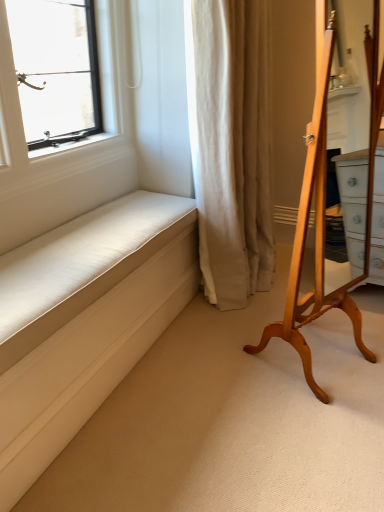
Question: Considering the positions of point (233, 29) and point (372, 78), is point (233, 29) closer or farther from the camera than point (372, 78)?

Choices:
 (A) closer
 (B) farther

Answer: (A)

Question: Considering the relative positions of beige fabric curtain at center and light brown wooden mirror at right in the image provided, is beige fabric curtain at center to the left or to the right of light brown wooden mirror at right?

Choices:
 (A) left
 (B) right

Answer: (A)

Question: Which of these objects is positioned closest to the white fabric cushion at lower left?

Choices:
 (A) beige fabric curtain at center
 (B) light brown wooden mirror at right

Answer: (A)

Question: Which is nearer to the light brown wooden mirror at right?

Choices:
 (A) beige fabric curtain at center
 (B) white fabric cushion at lower left

Answer: (A)